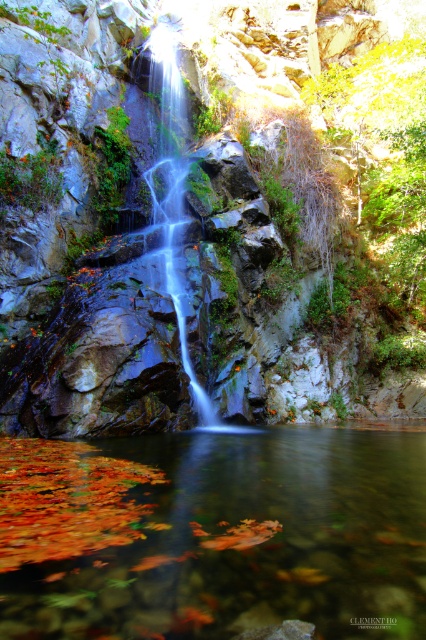
Does translucent water at center have a larger size compared to translucent glass waterfall at center?

Incorrect, translucent water at center is not larger than translucent glass waterfall at center.

Is translucent water at center thinner than translucent glass waterfall at center?

Indeed, translucent water at center has a lesser width compared to translucent glass waterfall at center.

In the scene shown: Who is more distant from viewer, (336,442) or (186,356)?

Point (186,356)

You are a GUI agent. You are given a task and a screenshot of the screen. Output one action in this format:
    pyautogui.click(x=<x>, y=<y>)
    Task: Click on the translucent water at center
    
    Given the screenshot: What is the action you would take?
    pyautogui.click(x=247, y=541)